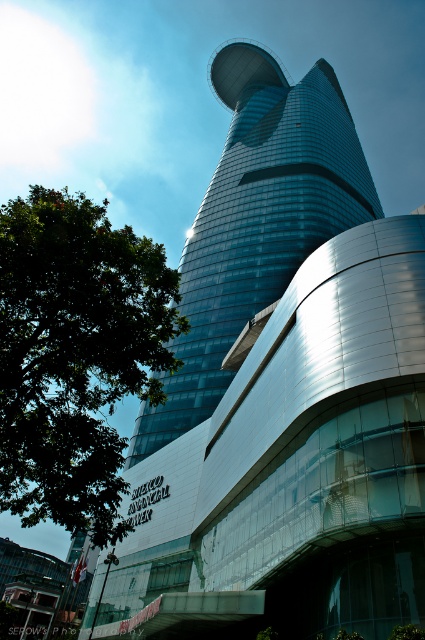
Which of these two, green leafy tree at left or shiny glass tower at center, stands taller?

Standing taller between the two is shiny glass tower at center.

Is point (56, 232) positioned in front of point (229, 314)?

Yes, it is.

Image resolution: width=425 pixels, height=640 pixels. I want to click on green leafy tree at left, so click(x=74, y=355).